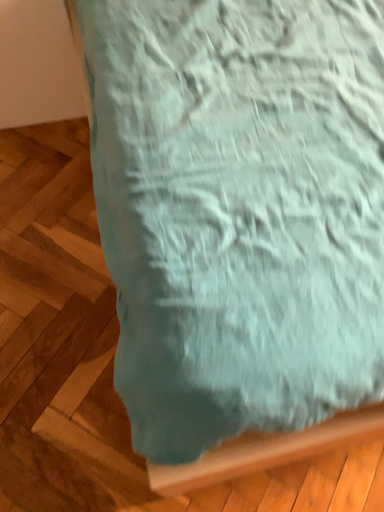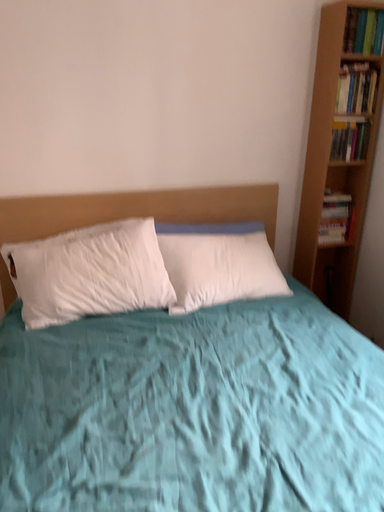
Question: Which way did the camera rotate in the video?

Choices:
 (A) rotated downward
 (B) rotated upward

Answer: (B)